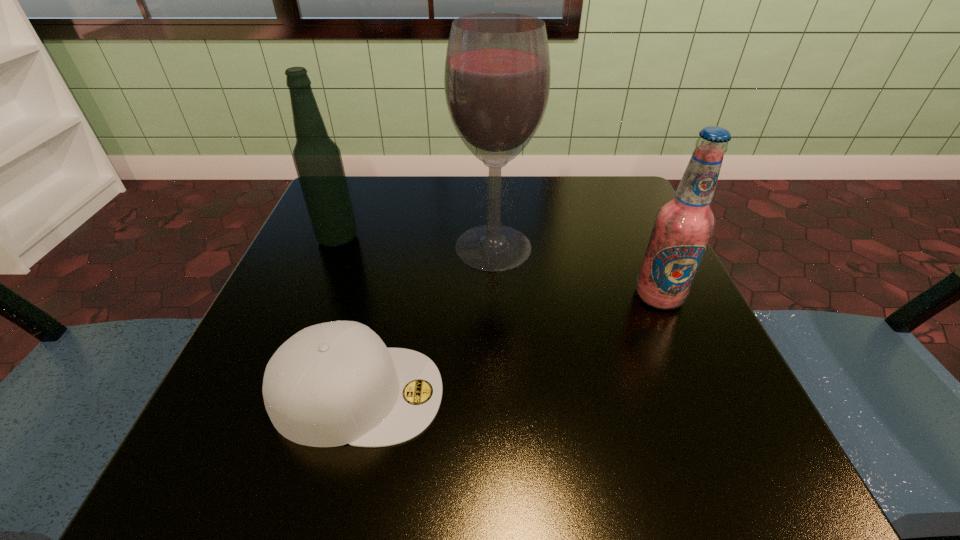
At what (x,y) coordinates should I click in order to perform the action: click on free point between the tallest alcohol and the leftmost alcohol. Please return your answer as a coordinate pair (x, y). Looking at the image, I should click on (416, 243).

This screenshot has width=960, height=540. Find the location of `object that is the second closest to the leftmost alcohol`. object that is the second closest to the leftmost alcohol is located at coordinates (335, 383).

Locate which object is the second closest to the nearest object. Please provide its 2D coordinates. Your answer should be formatted as a tuple, i.e. [(x, y)], where the tuple contains the x and y coordinates of a point satisfying the conditions above.

[(317, 159)]

Identify which alcohol is the closest to the nearest alcohol. Please provide its 2D coordinates. Your answer should be formatted as a tuple, i.e. [(x, y)], where the tuple contains the x and y coordinates of a point satisfying the conditions above.

[(497, 74)]

The width and height of the screenshot is (960, 540). What are the coordinates of `alcohol that can be found as the closest to the leftmost alcohol` in the screenshot? It's located at (497, 74).